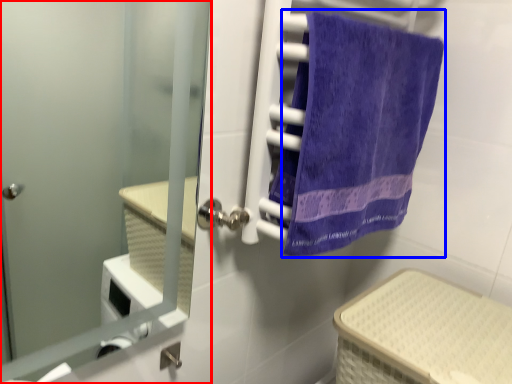
Question: Which object is closer to the camera taking this photo, door (highlighted by a red box) or towel (highlighted by a blue box)?

Choices:
 (A) door
 (B) towel

Answer: (A)